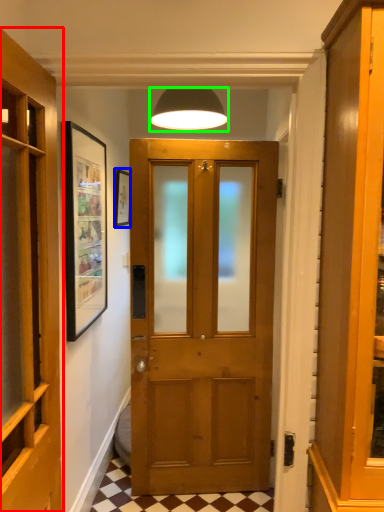
Question: Which object is positioned farthest from door (highlighted by a red box)? Select from picture frame (highlighted by a blue box) and lamp (highlighted by a green box).

Choices:
 (A) picture frame
 (B) lamp

Answer: (A)